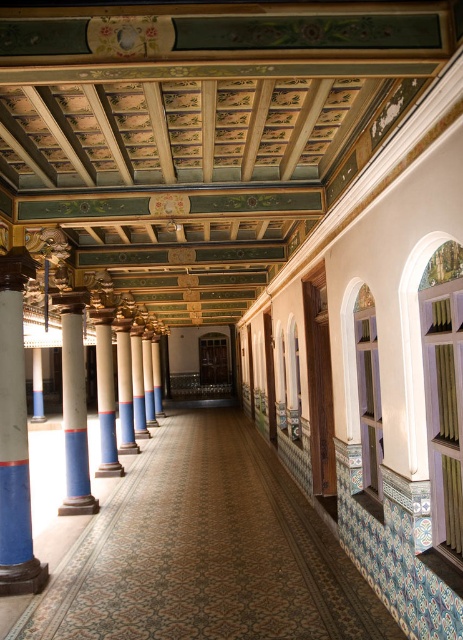
Question: From the image, what is the correct spatial relationship of marble column at left in relation to white glossy column at center?

Choices:
 (A) right
 (B) left

Answer: (A)

Question: Among these objects, which one is nearest to the camera?

Choices:
 (A) white glossy column at center
 (B) marble column at left

Answer: (B)

Question: Does marble column at left appear under white glossy column at center?

Choices:
 (A) no
 (B) yes

Answer: (A)

Question: Does marble column at left have a smaller size compared to white glossy column at center?

Choices:
 (A) no
 (B) yes

Answer: (A)

Question: Which of the following is the closest to the observer?

Choices:
 (A) (6, 308)
 (B) (79, 419)

Answer: (A)